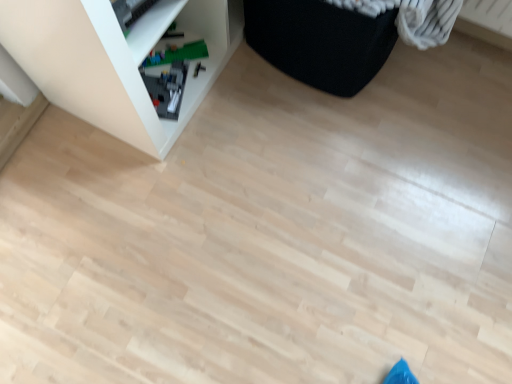
Find the location of a particular element. Image resolution: width=512 pixels, height=384 pixels. free space in front of black fabric ottoman at upper right is located at coordinates (314, 150).